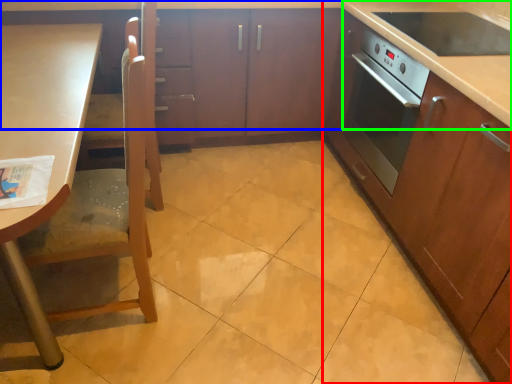
Question: Which is farther away from cabinetry (highlighted by a red box)? cabinetry (highlighted by a blue box) or counter top (highlighted by a green box)?

Choices:
 (A) cabinetry
 (B) counter top

Answer: (A)